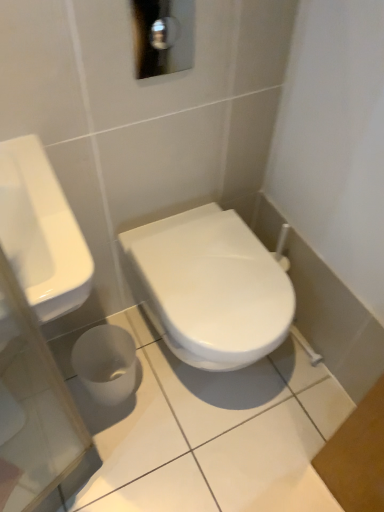
Question: Should I look upward or downward to see white glossy toilet at center?

Choices:
 (A) up
 (B) down

Answer: (B)

Question: Is white glossy toilet at center at the left side of white glossy sink at left?

Choices:
 (A) yes
 (B) no

Answer: (B)

Question: Considering the relative sizes of white glossy toilet at center and white glossy sink at left in the image provided, is white glossy toilet at center smaller than white glossy sink at left?

Choices:
 (A) no
 (B) yes

Answer: (A)

Question: Is white glossy toilet at center facing away from white glossy sink at left?

Choices:
 (A) yes
 (B) no

Answer: (B)

Question: Are white glossy toilet at center and white glossy sink at left far apart?

Choices:
 (A) yes
 (B) no

Answer: (B)

Question: Is white glossy toilet at center thinner than white glossy sink at left?

Choices:
 (A) yes
 (B) no

Answer: (B)

Question: Considering the relative sizes of white glossy toilet at center and white glossy sink at left in the image provided, is white glossy toilet at center wider than white glossy sink at left?

Choices:
 (A) yes
 (B) no

Answer: (A)

Question: Is white glossy sink at left at the left side of white glossy toilet at center?

Choices:
 (A) no
 (B) yes

Answer: (B)

Question: Does white glossy sink at left have a lesser width compared to white glossy toilet at center?

Choices:
 (A) no
 (B) yes

Answer: (B)

Question: Is white glossy sink at left aimed at white glossy toilet at center?

Choices:
 (A) no
 (B) yes

Answer: (A)

Question: Is white glossy sink at left placed right next to white glossy toilet at center?

Choices:
 (A) yes
 (B) no

Answer: (B)

Question: From the image's perspective, is white glossy sink at left on white glossy toilet at center?

Choices:
 (A) yes
 (B) no

Answer: (A)

Question: Can you confirm if white glossy sink at left is bigger than white glossy toilet at center?

Choices:
 (A) yes
 (B) no

Answer: (B)

Question: From the image's perspective, relative to white glossy toilet at center, is white glossy sink at left above or below?

Choices:
 (A) above
 (B) below

Answer: (A)